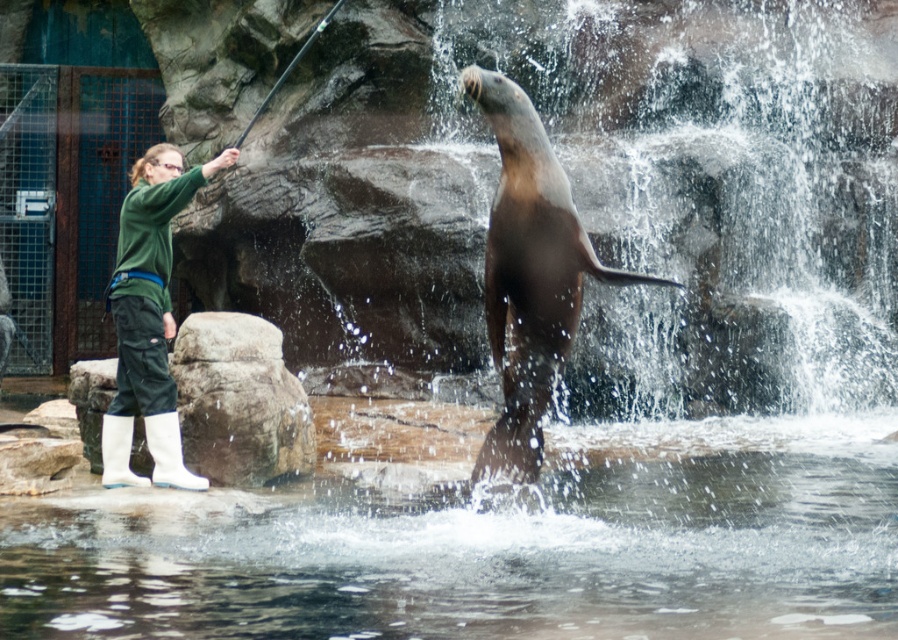
Question: Which point is closer to the camera?

Choices:
 (A) (882, 572)
 (B) (126, 336)
 (C) (192, 353)

Answer: (A)

Question: Where is brown matte seal at center located in relation to gray rock at center in the image?

Choices:
 (A) above
 (B) below

Answer: (A)

Question: Is brown matte seal at center bigger than green fabric pants at left?

Choices:
 (A) yes
 (B) no

Answer: (B)

Question: Estimate the real-world distances between objects in this image. Which object is closer to the clear water at lower center?

Choices:
 (A) green fabric pants at left
 (B) brown matte seal at center
 (C) green fabric cage at left
 (D) gray rock at center

Answer: (D)

Question: Which point appears farthest from the camera in this image?

Choices:
 (A) (588, 576)
 (B) (22, 97)

Answer: (B)

Question: Can you confirm if clear water at lower center is positioned to the left of gray rock at center?

Choices:
 (A) no
 (B) yes

Answer: (A)